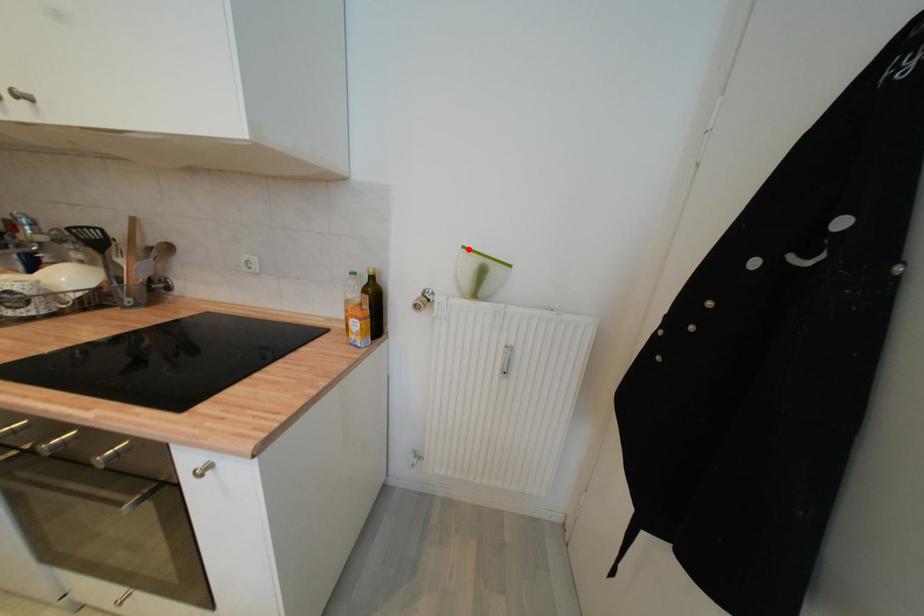
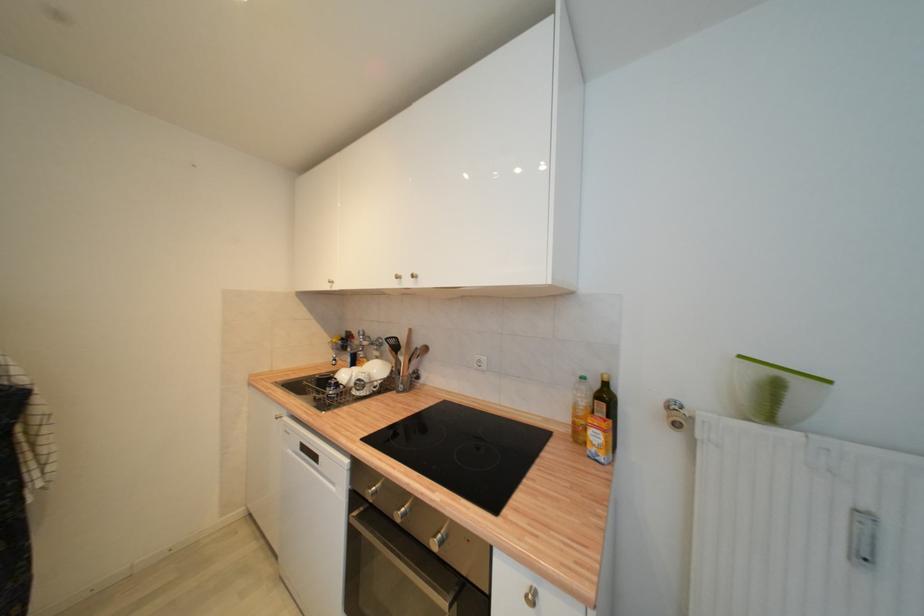
In the second image, find the point that corresponds to the highlighted location in the first image.

(746, 359)